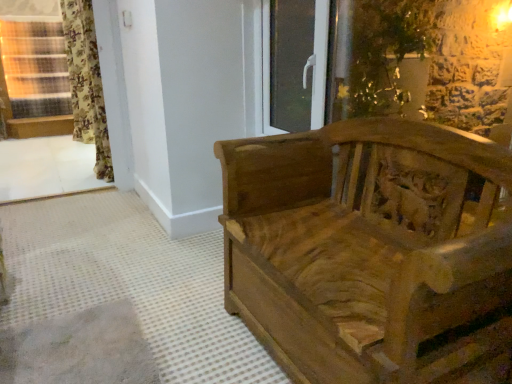
This screenshot has height=384, width=512. Find the location of `free location in front of wooden window frame at lower left`. free location in front of wooden window frame at lower left is located at coordinates (25, 251).